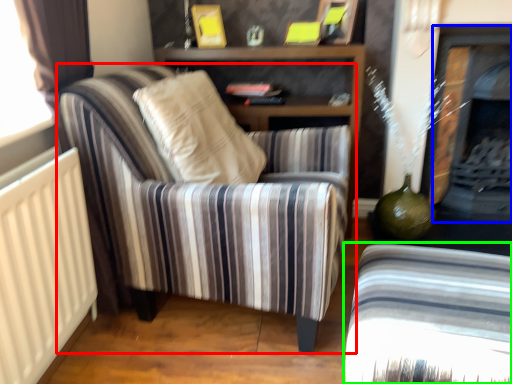
Question: Which is nearer to the chair (highlighted by a red box)? fireplace (highlighted by a blue box) or chair (highlighted by a green box).

Choices:
 (A) fireplace
 (B) chair

Answer: (B)